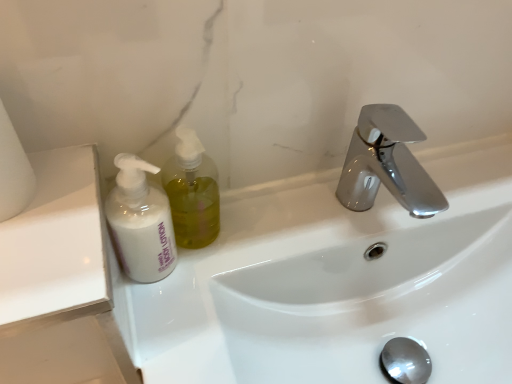
Locate an element on the screen. The width and height of the screenshot is (512, 384). empty space that is to the right of translucent yellow liquid at left is located at coordinates (282, 218).